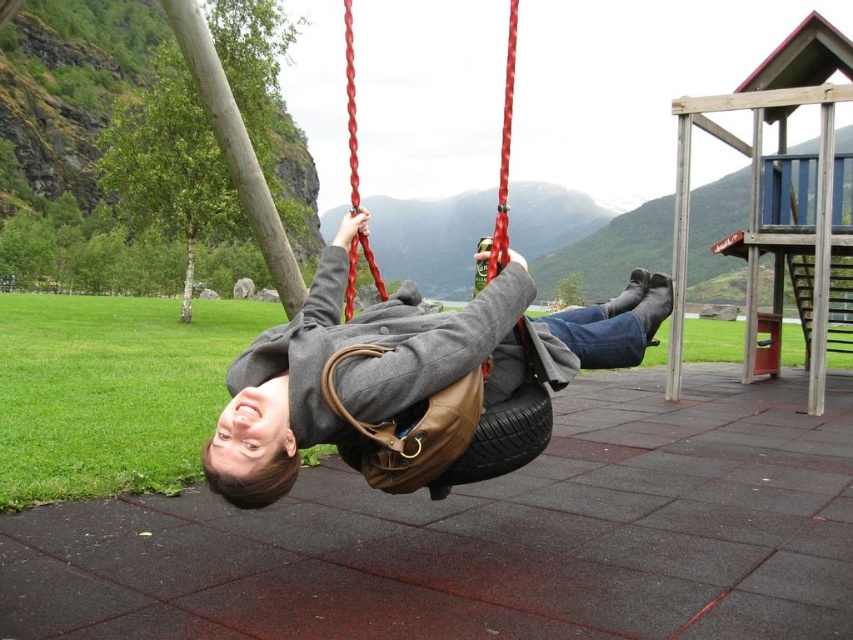
You are a photographer standing to the left of the gray wool coat at center and the rubber tire swing at center. You want to take a photo of the person on the swing without including the coat in the frame. Which direction should you move to ensure the coat is out of the shot?

The gray wool coat at center is on the left side of the rubber tire swing at center. To avoid including the coat in the photo, you should move to the right side of the swing so that the coat is no longer in the frame.

You are a photographer trying to capture a photo of the gray wool coat at center and the rubber tire swing at center. If you want to ensure both objects are fully visible in the frame, which object should you focus on first to avoid cropping?

The gray wool coat at center is shorter than the rubber tire swing at center, so you should focus on the rubber tire swing at center first to ensure it is fully visible before adjusting the frame to include the shorter gray wool coat at center.

You are standing at the point labeled as point (345, 36) in the park scene. You want to walk directly towards the tire swing where the person is lying. Which direction should you move relative to point (495, 374)?

Since point (495, 374) is in front of point (345, 36), you should move towards the direction of point (495, 374) to reach the tire swing.